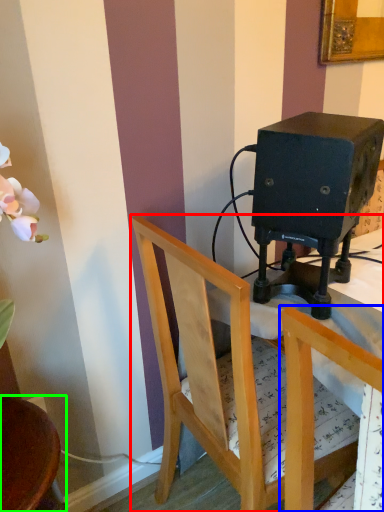
Question: Estimate the real-world distances between objects in this image. Which object is closer to chair (highlighted by a red box), chair (highlighted by a blue box) or chair (highlighted by a green box)?

Choices:
 (A) chair
 (B) chair

Answer: (A)